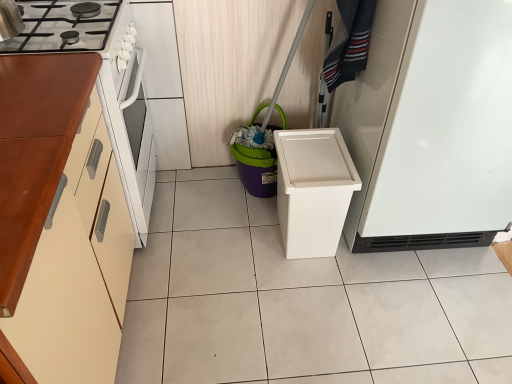
Identify the location of free location in front of white matte refrigerator at right. (407, 316).